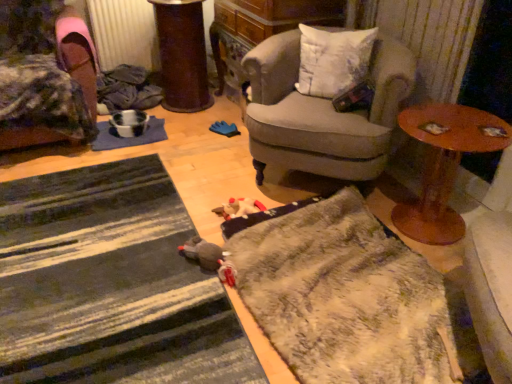
Locate an element on the screen. free space to the left of gray fabric armchair at center, arranged as the first chair when viewed from the right is located at coordinates (210, 167).